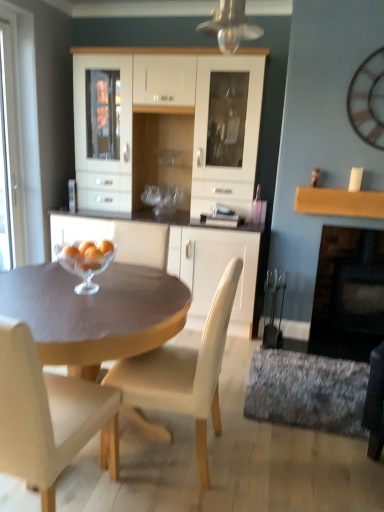
Question: Is wooden clock at upper right oriented away from black matte fireplace at right?

Choices:
 (A) no
 (B) yes

Answer: (A)

Question: From the image's perspective, is wooden clock at upper right on black matte fireplace at right?

Choices:
 (A) yes
 (B) no

Answer: (A)

Question: Is wooden clock at upper right positioned in front of black matte fireplace at right?

Choices:
 (A) no
 (B) yes

Answer: (B)

Question: Can you confirm if wooden clock at upper right is taller than black matte fireplace at right?

Choices:
 (A) yes
 (B) no

Answer: (B)

Question: Is wooden clock at upper right facing towards black matte fireplace at right?

Choices:
 (A) no
 (B) yes

Answer: (A)

Question: Is wooden clock at upper right inside or outside of matte brown table at center?

Choices:
 (A) outside
 (B) inside

Answer: (A)

Question: Considering the positions of wooden clock at upper right and matte brown table at center in the image, is wooden clock at upper right bigger or smaller than matte brown table at center?

Choices:
 (A) big
 (B) small

Answer: (B)

Question: Is wooden clock at upper right in front of or behind matte brown table at center in the image?

Choices:
 (A) behind
 (B) front

Answer: (A)

Question: Considering the positions of wooden clock at upper right and matte brown table at center in the image, is wooden clock at upper right taller or shorter than matte brown table at center?

Choices:
 (A) tall
 (B) short

Answer: (B)

Question: Is black matte fireplace at right bigger or smaller than beige leather chair at center, the 1th chair positioned from the left?

Choices:
 (A) small
 (B) big

Answer: (A)

Question: In the image, is black matte fireplace at right on the left side or the right side of beige leather chair at center, which appears as the 2th chair when viewed from the right?

Choices:
 (A) left
 (B) right

Answer: (B)

Question: Relative to beige leather chair at center, the 1th chair positioned from the left, is black matte fireplace at right in front or behind?

Choices:
 (A) front
 (B) behind

Answer: (B)

Question: Does point (364, 340) appear closer or farther from the camera than point (6, 422)?

Choices:
 (A) farther
 (B) closer

Answer: (A)

Question: Is point (200, 343) positioned closer to the camera than point (357, 96)?

Choices:
 (A) closer
 (B) farther

Answer: (B)

Question: In the image, is white leather chair at center, the 2th chair viewed from the left, on the left side or the right side of wooden clock at upper right?

Choices:
 (A) left
 (B) right

Answer: (A)